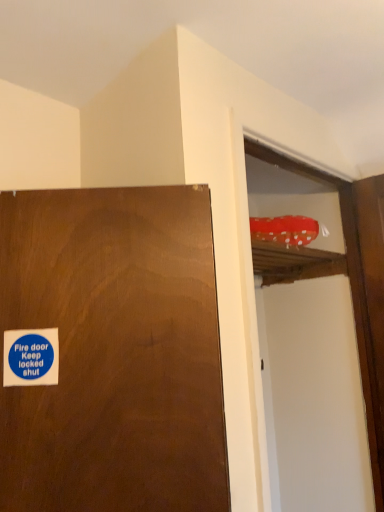
Question: Is blue paper sticker at lower left at the right side of red polka dot fabric at upper right?

Choices:
 (A) yes
 (B) no

Answer: (B)

Question: Considering the relative sizes of blue paper sticker at lower left and red polka dot fabric at upper right in the image provided, is blue paper sticker at lower left smaller than red polka dot fabric at upper right?

Choices:
 (A) yes
 (B) no

Answer: (A)

Question: Are blue paper sticker at lower left and red polka dot fabric at upper right located far from each other?

Choices:
 (A) no
 (B) yes

Answer: (B)

Question: Considering the relative positions of blue paper sticker at lower left and red polka dot fabric at upper right in the image provided, is blue paper sticker at lower left to the left of red polka dot fabric at upper right from the viewer's perspective?

Choices:
 (A) no
 (B) yes

Answer: (B)

Question: Is the surface of blue paper sticker at lower left in direct contact with red polka dot fabric at upper right?

Choices:
 (A) no
 (B) yes

Answer: (A)

Question: Is red polka dot fabric at upper right completely or partially inside blue paper sticker at lower left?

Choices:
 (A) yes
 (B) no

Answer: (B)

Question: Could blue paper sticker at lower left be considered to be inside red polka dot fabric at upper right?

Choices:
 (A) no
 (B) yes

Answer: (A)

Question: Is red polka dot fabric at upper right at the left side of blue paper sticker at lower left?

Choices:
 (A) no
 (B) yes

Answer: (A)

Question: Can you confirm if red polka dot fabric at upper right is wider than blue paper sticker at lower left?

Choices:
 (A) no
 (B) yes

Answer: (B)

Question: Is red polka dot fabric at upper right looking in the opposite direction of blue paper sticker at lower left?

Choices:
 (A) yes
 (B) no

Answer: (B)

Question: Considering the relative sizes of red polka dot fabric at upper right and blue paper sticker at lower left in the image provided, is red polka dot fabric at upper right smaller than blue paper sticker at lower left?

Choices:
 (A) no
 (B) yes

Answer: (A)

Question: Is red polka dot fabric at upper right positioned beyond the bounds of blue paper sticker at lower left?

Choices:
 (A) yes
 (B) no

Answer: (A)

Question: From the image's perspective, is red polka dot fabric at upper right located above or below blue paper sticker at lower left?

Choices:
 (A) below
 (B) above

Answer: (A)